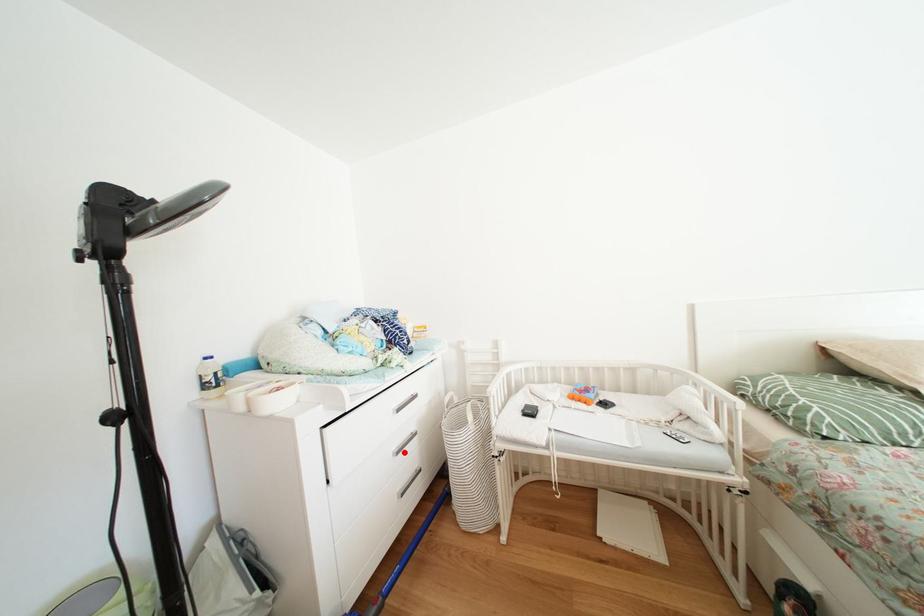
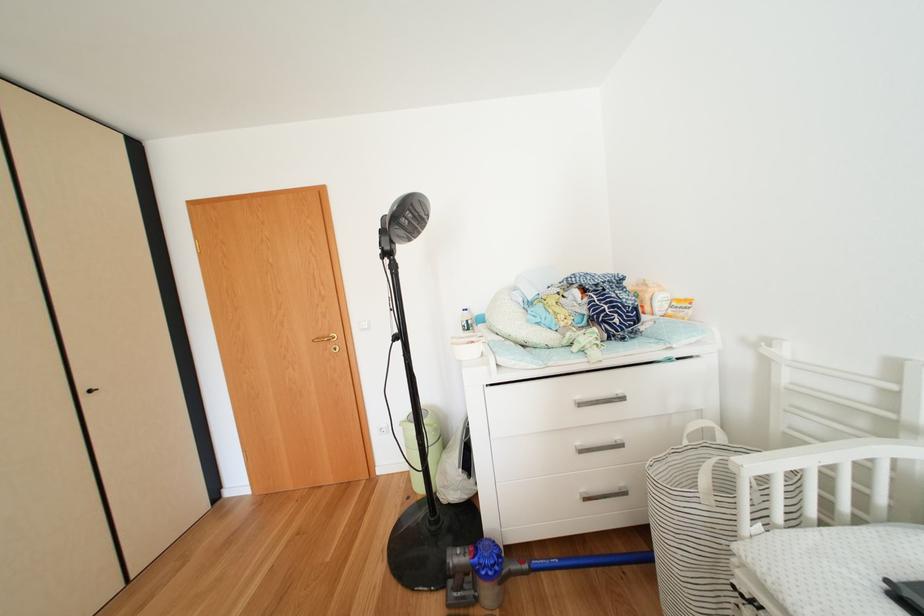
Question: A red point is marked in image1. In image2, is the corresponding 3D point closer to the camera or farther? Reply with the corresponding letter.

Choices:
 (A) The corresponding 3D point is closer.
 (B) The corresponding 3D point is farther.

Answer: (A)